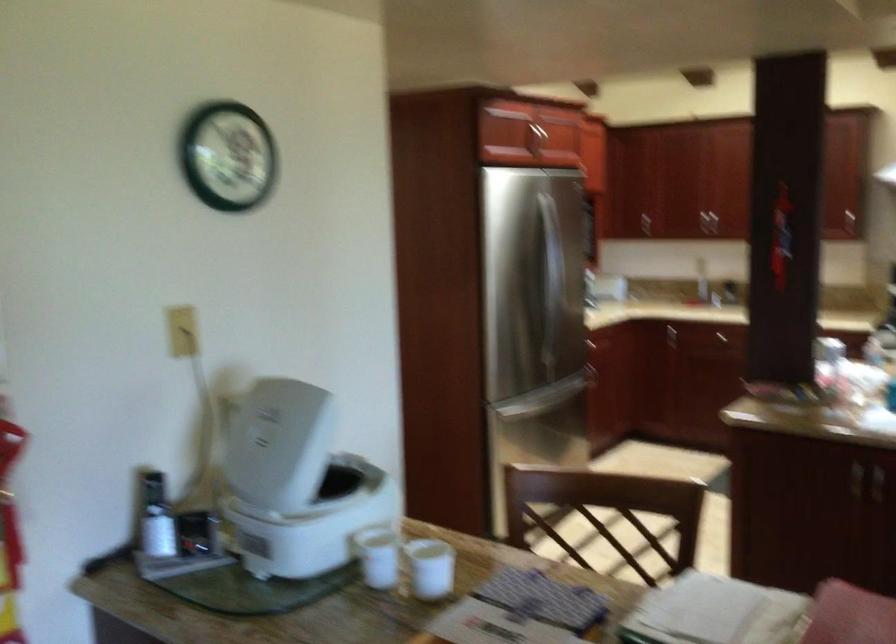
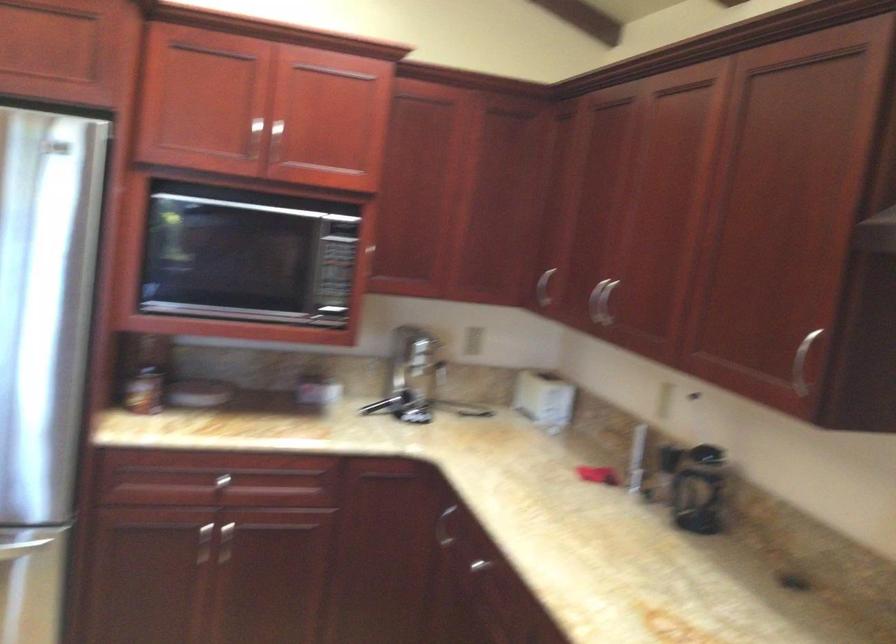
Where in the second image is the point corresponding to point (684, 202) from the first image?

(600, 301)